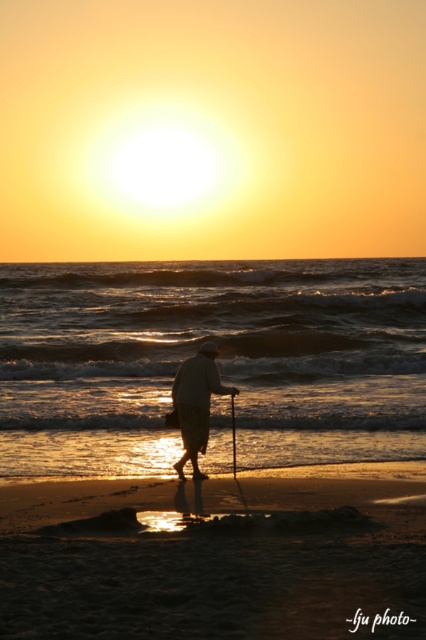
You are a photographer wanting to capture the silhouette of the person on the beach. You are standing at the shore and see the sandy beach at lower center and the white cloth at center. Which object is closer to you?

The sandy beach at lower center is closer to you because it is in front of the white cloth at center.

You are standing at the point marked by coordinates point (216,556). Looking towards the sunset, which direction should you walk to reach the shoreline?

The sandy beach at lower center is represented by point (216,556). Since the sunset is occurring at the horizon where the sun is positioned low on the horizon, the shoreline is likely in the direction of the sunset. Therefore, walking towards the sunset would lead you towards the shoreline.

You are standing on the beach and see two points marked on the sand. One is at point (221, 520) and the other at point (210, 378). Which point is closer to you?

Point (221, 520) is closer to the viewer than point (210, 378).